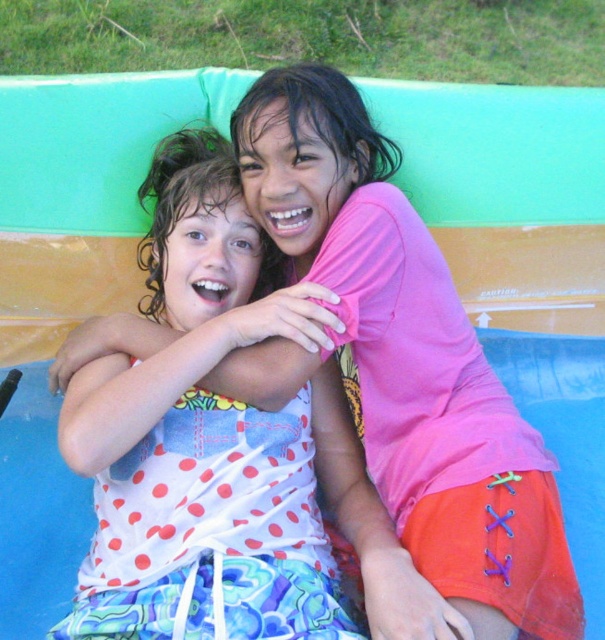
You are a photographer trying to capture a closeup shot of the pink matte shirt at center and the white polka dot fabric at center. Given that your camera can only focus on objects within 7 inches of each other, will both items be in focus?

The distance between the pink matte shirt at center and white polka dot fabric at center is 6.99 inches, which is within the 7 inch focus range. Therefore, both items will be in focus.

You are a photographer trying to capture a closeup of the pink matte shirt at center and the white polka dot fabric at center. Which one is positioned to the right side of the other?

The pink matte shirt at center is positioned to the right of the white polka dot fabric at center.

Consider the image. You are a photographer trying to capture a closeup of both the pink matte shirt at center and the white polka dot fabric at center. Since you want to focus on the smaller one, which one should you adjust your camera to prioritize?

The pink matte shirt at center occupies less space than the white polka dot fabric at center, so you should prioritize focusing on the pink matte shirt at center to ensure it is clearly captured in the closeup.